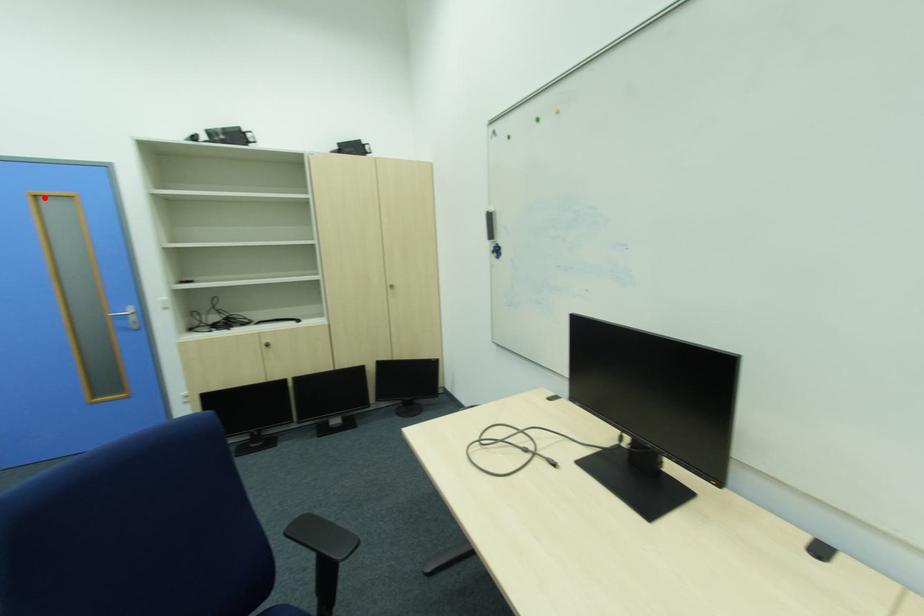
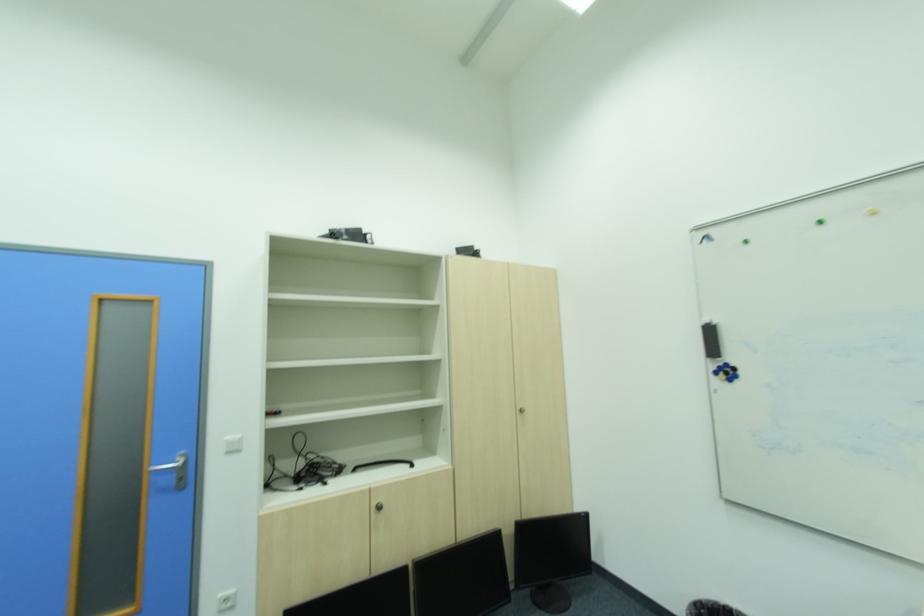
In the second image, find the point that corresponds to the highlighted location in the first image.

(111, 300)